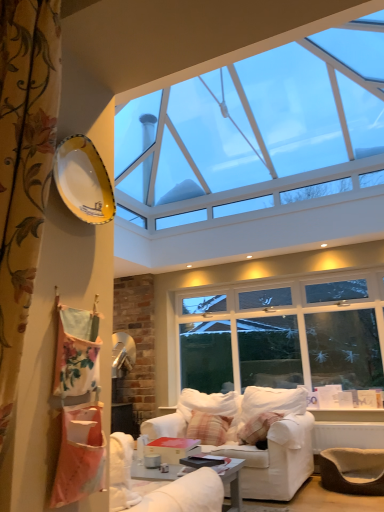
Question: Considering the relative sizes of yellow glossy plate at upper left and white fabric couch at center in the image provided, is yellow glossy plate at upper left bigger than white fabric couch at center?

Choices:
 (A) yes
 (B) no

Answer: (B)

Question: Does yellow glossy plate at upper left come in front of white fabric couch at center?

Choices:
 (A) yes
 (B) no

Answer: (A)

Question: Is yellow glossy plate at upper left smaller than white fabric couch at center?

Choices:
 (A) no
 (B) yes

Answer: (B)

Question: Is yellow glossy plate at upper left aimed at white fabric couch at center?

Choices:
 (A) no
 (B) yes

Answer: (A)

Question: Considering the relative positions of yellow glossy plate at upper left and white fabric couch at center in the image provided, is yellow glossy plate at upper left to the right of white fabric couch at center from the viewer's perspective?

Choices:
 (A) yes
 (B) no

Answer: (B)

Question: Would you say white fabric couch at center is part of yellow glossy plate at upper left's contents?

Choices:
 (A) yes
 (B) no

Answer: (B)

Question: Considering the relative sizes of transparent glass window at upper center and brown woven armchair at lower right in the image provided, is transparent glass window at upper center thinner than brown woven armchair at lower right?

Choices:
 (A) yes
 (B) no

Answer: (B)

Question: Is transparent glass window at upper center facing towards brown woven armchair at lower right?

Choices:
 (A) no
 (B) yes

Answer: (A)

Question: From the image's perspective, does transparent glass window at upper center appear higher than brown woven armchair at lower right?

Choices:
 (A) no
 (B) yes

Answer: (B)

Question: Is transparent glass window at upper center not within brown woven armchair at lower right?

Choices:
 (A) no
 (B) yes

Answer: (B)

Question: Is transparent glass window at upper center wider than brown woven armchair at lower right?

Choices:
 (A) yes
 (B) no

Answer: (A)

Question: From the image's perspective, is transparent glass window at upper center located beneath brown woven armchair at lower right?

Choices:
 (A) no
 (B) yes

Answer: (A)

Question: Considering the relative sizes of transparent glass window at upper center and yellow glossy plate at upper left in the image provided, is transparent glass window at upper center taller than yellow glossy plate at upper left?

Choices:
 (A) no
 (B) yes

Answer: (A)